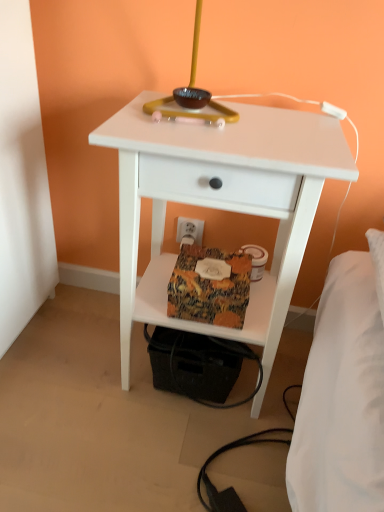
The width and height of the screenshot is (384, 512). Find the location of `unoccupied region to the right of matte yellow table lamp at upper center`. unoccupied region to the right of matte yellow table lamp at upper center is located at coordinates (290, 131).